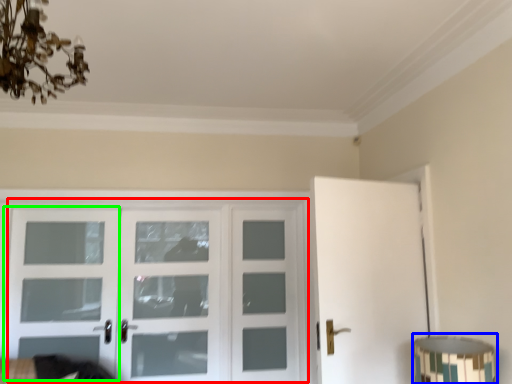
Question: Based on their relative distances, which object is farther from door (highlighted by a red box)? Choose from table lamp (highlighted by a blue box) and screen door (highlighted by a green box).

Choices:
 (A) table lamp
 (B) screen door

Answer: (A)